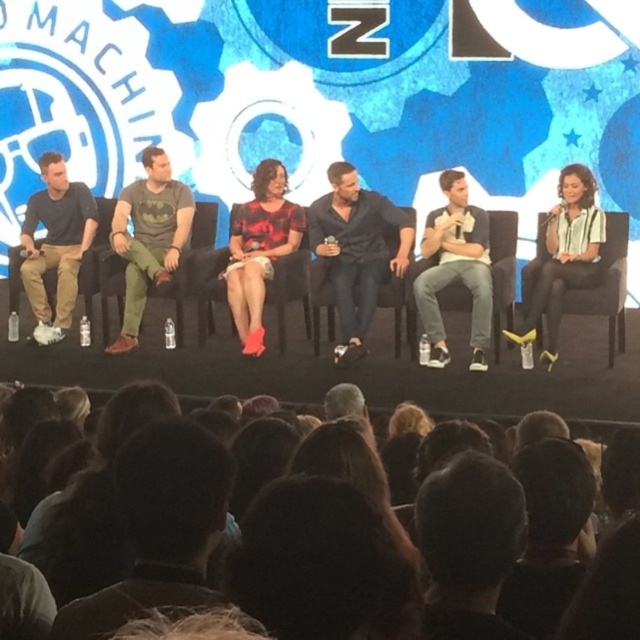
Is point (166, 232) positioned in front of point (236, 280)?

No, (166, 232) is behind (236, 280).

Does point (150, 221) come behind point (266, 195)?

That is True.

Where is `batman t-shirt at center`? This screenshot has width=640, height=640. batman t-shirt at center is located at coordinates [148, 236].

Find the location of a particular element. This screenshot has height=640, width=640. batman t-shirt at center is located at coordinates (148, 236).

Is the position of black leather jacket at center less distant than that of batman t-shirt at center?

Yes, black leather jacket at center is in front of batman t-shirt at center.

Is point (340, 220) in front of point (168, 230)?

Yes, point (340, 220) is closer to viewer.

Where is `black leather jacket at center`? black leather jacket at center is located at coordinates (356, 248).

Is batman t-shirt at center thinner than white striped shirt at center?

Yes, batman t-shirt at center is thinner than white striped shirt at center.

Is batman t-shirt at center above white striped shirt at center?

Yes.

I want to click on batman t-shirt at center, so click(148, 236).

Where is `batman t-shirt at center`? Image resolution: width=640 pixels, height=640 pixels. batman t-shirt at center is located at coordinates (148, 236).